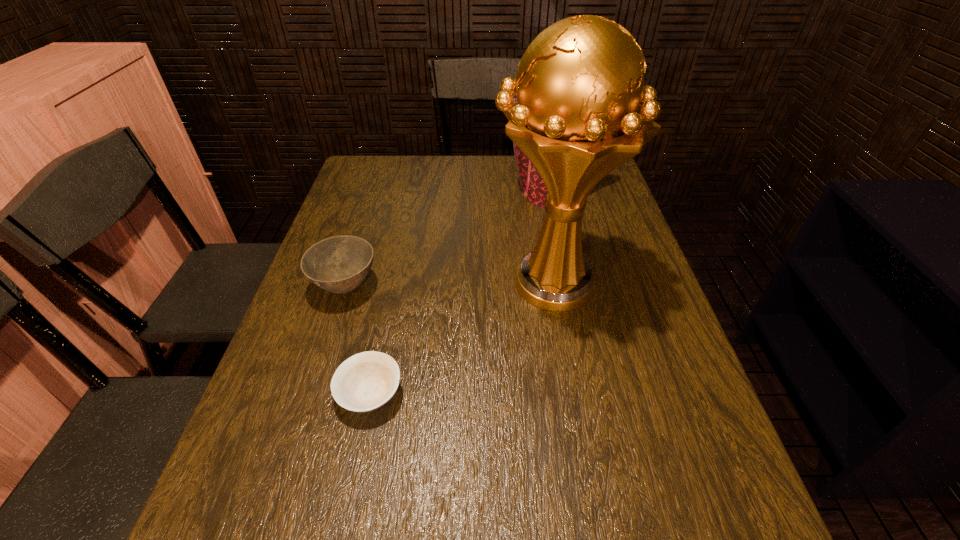
What are the coordinates of `object that is the second closest one to the taller bowl` in the screenshot? It's located at (582, 110).

You are a GUI agent. You are given a task and a screenshot of the screen. Output one action in this format:
    pyautogui.click(x=<x>, y=<y>)
    Task: Click on the free space that satisfies the following two spatial constraints: 1. at the front of the trophy_cup where the globe is prominent; 2. on the front side of the taller bowl
    This screenshot has height=540, width=960.
    Given the screenshot: What is the action you would take?
    pyautogui.click(x=551, y=287)

Identify the location of free point that satisfies the following two spatial constraints: 1. at the front of the trophy_cup where the globe is prominent; 2. on the front side of the nearest object. (569, 394).

Locate an element on the screen. This screenshot has width=960, height=540. vacant space that satisfies the following two spatial constraints: 1. on the back side of the farthest object; 2. on the left side of the taller bowl is located at coordinates pos(376,193).

The height and width of the screenshot is (540, 960). In order to click on free space in the image that satisfies the following two spatial constraints: 1. on the front side of the taller bowl; 2. on the right side of the nearer bowl in this screenshot , I will do `click(312, 394)`.